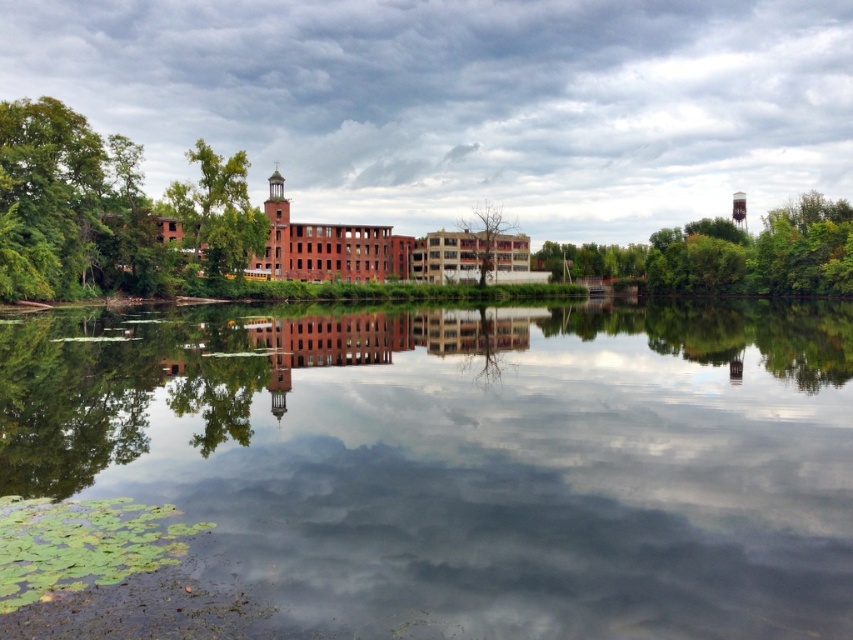
Question: From the image, what is the correct spatial relationship of green leafy tree at left in relation to green leafy tree at upper left?

Choices:
 (A) left
 (B) right

Answer: (A)

Question: Is transparent glass river at center to the left of green leafy tree at left from the viewer's perspective?

Choices:
 (A) no
 (B) yes

Answer: (A)

Question: Which object appears closest to the camera in this image?

Choices:
 (A) brown leafless tree at center
 (B) green leafy tree at left

Answer: (B)

Question: Estimate the real-world distances between objects in this image. Which object is closer to the green leafy tree at upper left?

Choices:
 (A) brown leafless tree at center
 (B) green leafy tree at left

Answer: (B)

Question: Is green leafy tree at left to the right of brown leafless tree at center from the viewer's perspective?

Choices:
 (A) no
 (B) yes

Answer: (A)

Question: Which point appears closest to the camera in this image?

Choices:
 (A) (554, 256)
 (B) (245, 262)

Answer: (B)